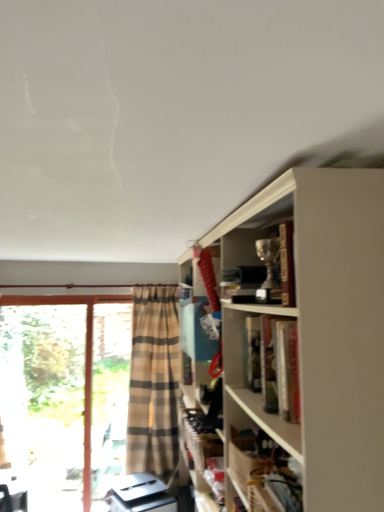
Where is `metallic trophy at upper right`? This screenshot has width=384, height=512. metallic trophy at upper right is located at coordinates (247, 247).

What do you see at coordinates (64, 400) in the screenshot? The image size is (384, 512). I see `transparent glass door at left` at bounding box center [64, 400].

In the scene shown: Measure the distance between clear glass screen door at left and camera.

The depth of clear glass screen door at left is 3.17 meters.

Locate an element on the screen. This screenshot has width=384, height=512. clear glass screen door at left is located at coordinates pyautogui.click(x=109, y=393).

In order to face beige plaid curtain at left, should I rotate leftwards or rightwards?

To align with it, rotate left about 5.104°.

Find the location of a particular element. wooden shelf at lower right is located at coordinates (263, 422).

Does wooden shelf at lower right turn towards clear glass screen door at left?

No, wooden shelf at lower right does not turn towards clear glass screen door at left.

From the picture: Is wooden shelf at lower right not within clear glass screen door at left?

Yes, wooden shelf at lower right is outside of clear glass screen door at left.

Based on the photo, looking at their sizes, would you say wooden shelf at lower right is wider or thinner than clear glass screen door at left?

Clearly, wooden shelf at lower right has more width compared to clear glass screen door at left.

Locate an element on the screen. The height and width of the screenshot is (512, 384). screen door lying below the wooden shelf at lower right (from the image's perspective) is located at coordinates (109, 393).

Is clear glass screen door at left taller than beige plaid curtain at left?

Correct, clear glass screen door at left is much taller as beige plaid curtain at left.

How different are the orientations of clear glass screen door at left and beige plaid curtain at left in degrees?

The angle between the facing direction of clear glass screen door at left and the facing direction of beige plaid curtain at left is 3.88 degrees.

Would you say clear glass screen door at left contains beige plaid curtain at left?

Actually, beige plaid curtain at left is outside clear glass screen door at left.

Are clear glass screen door at left and beige plaid curtain at left located far from each other?

clear glass screen door at left is near beige plaid curtain at left, not far away.

Can you tell me how much metallic trophy at upper right and beige plaid curtain at left differ in facing direction?

96.5 degrees separate the facing orientations of metallic trophy at upper right and beige plaid curtain at left.

Relative to beige plaid curtain at left, is metallic trophy at upper right in front or behind?

Visually, metallic trophy at upper right is located in front of beige plaid curtain at left.

Which point is more distant from viewer, (x=227, y=240) or (x=133, y=371)?

The point (x=133, y=371) is more distant.

Are transparent glass door at left and wooden shelf at lower right far apart?

transparent glass door at left is positioned a significant distance from wooden shelf at lower right.

Can you confirm if transparent glass door at left is thinner than wooden shelf at lower right?

Yes, transparent glass door at left is thinner than wooden shelf at lower right.

How distant is transparent glass door at left from wooden shelf at lower right?

transparent glass door at left and wooden shelf at lower right are 2.38 meters apart from each other.

Is transparent glass door at left positioned with its back to wooden shelf at lower right?

transparent glass door at left is not turned away from wooden shelf at lower right.

Which is behind, clear glass screen door at left or metallic trophy at upper right?

clear glass screen door at left.

Choose the correct answer: Is clear glass screen door at left inside metallic trophy at upper right or outside it?

clear glass screen door at left exists outside the volume of metallic trophy at upper right.

Looking at the image, does clear glass screen door at left seem bigger or smaller compared to metallic trophy at upper right?

Considering their sizes, clear glass screen door at left takes up more space than metallic trophy at upper right.

From the image's perspective, which one is positioned lower, clear glass screen door at left or metallic trophy at upper right?

clear glass screen door at left is shown below in the image.

From a real-world perspective, is clear glass screen door at left on top of wooden shelf at lower right?

No, from a real-world perspective, clear glass screen door at left is not on top of wooden shelf at lower right.

Considering the sizes of objects clear glass screen door at left and wooden shelf at lower right in the image provided, who is shorter, clear glass screen door at left or wooden shelf at lower right?

wooden shelf at lower right.

Is clear glass screen door at left next to wooden shelf at lower right and touching it?

They are not placed beside each other.

Who is shorter, transparent glass door at left or clear glass screen door at left?

With less height is clear glass screen door at left.

The height and width of the screenshot is (512, 384). What are the coordinates of `screen door that appears on the right of transparent glass door at left` in the screenshot? It's located at (109, 393).

Are transparent glass door at left and clear glass screen door at left located far from each other?

They are positioned close to each other.

What's the angular difference between transparent glass door at left and clear glass screen door at left's facing directions?

The facing directions of transparent glass door at left and clear glass screen door at left are 0.000487 degrees apart.

This screenshot has height=512, width=384. What are the coordinates of `shelf on the right of the clear glass screen door at left` in the screenshot? It's located at (263, 422).

Where is `screen door below the beige plaid curtain at left (from the image's perspective)`? This screenshot has width=384, height=512. screen door below the beige plaid curtain at left (from the image's perspective) is located at coordinates (109, 393).

Estimate the real-world distances between objects in this image. Which object is closer to wooden shelf at lower right, clear glass screen door at left or beige plaid curtain at left?

The object closer to wooden shelf at lower right is beige plaid curtain at left.

Looking at the image, which one is located further to beige plaid curtain at left, transparent glass door at left or wooden shelf at lower right?

wooden shelf at lower right.

Looking at this image, considering their positions, is metallic trophy at upper right positioned further to transparent glass door at left than clear glass screen door at left?

Among the two, metallic trophy at upper right is located further to transparent glass door at left.

Looking at the image, which one is located further to metallic trophy at upper right, transparent glass door at left or clear glass screen door at left?

transparent glass door at left lies further to metallic trophy at upper right than the other object.

Considering their positions, is transparent glass door at left positioned closer to wooden shelf at lower right than clear glass screen door at left?

clear glass screen door at left.

Looking at the image, which one is located closer to wooden shelf at lower right, clear glass screen door at left or metallic trophy at upper right?

metallic trophy at upper right lies closer to wooden shelf at lower right than the other object.

Estimate the real-world distances between objects in this image. Which object is closer to metallic trophy at upper right, clear glass screen door at left or wooden shelf at lower right?

wooden shelf at lower right lies closer to metallic trophy at upper right than the other object.

Based on their spatial positions, is wooden shelf at lower right or clear glass screen door at left closer to beige plaid curtain at left?

Among the two, clear glass screen door at left is located nearer to beige plaid curtain at left.

Find the location of a particular element. Image resolution: width=384 pixels, height=512 pixels. curtain positioned between metallic trophy at upper right and transparent glass door at left from near to far is located at coordinates (154, 383).

Identify the location of bay window located between metallic trophy at upper right and clear glass screen door at left in the depth direction. (64, 400).

The height and width of the screenshot is (512, 384). In order to click on curtain between wooden shelf at lower right and clear glass screen door at left along the z-axis in this screenshot , I will do `click(154, 383)`.

In order to click on book positioned between wooden shelf at lower right and beige plaid curtain at left from near to far in this screenshot , I will do `click(247, 247)`.